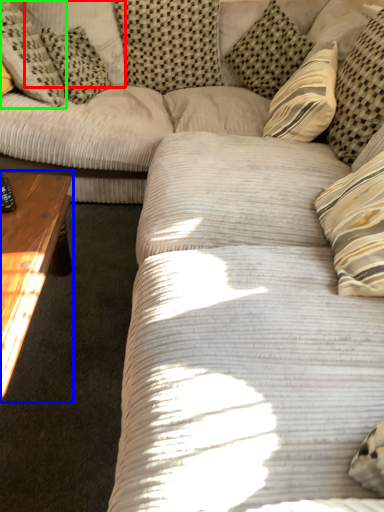
Question: Which object is the closest to the pillow (highlighted by a red box)? Choose among these: coffee table (highlighted by a blue box) or pillow (highlighted by a green box).

Choices:
 (A) coffee table
 (B) pillow

Answer: (B)